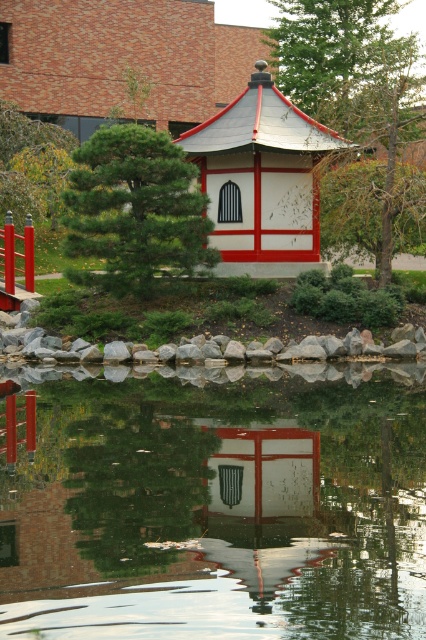
Who is positioned more to the left, green leafy tree at center or green leafy tree at upper left?

green leafy tree at upper left

This screenshot has width=426, height=640. In order to click on green leafy tree at center in this screenshot , I will do `click(353, 77)`.

Is green textured pine tree at center shorter than white matte gazebo at center?

In fact, green textured pine tree at center may be taller than white matte gazebo at center.

Does point (198, 234) come farther from viewer compared to point (284, 163)?

That is False.

The image size is (426, 640). Find the location of `green textured pine tree at center`. green textured pine tree at center is located at coordinates click(x=135, y=211).

Who is more distant from viewer, (x=127, y=634) or (x=89, y=198)?

Positioned behind is point (x=89, y=198).

The image size is (426, 640). Find the location of `transparent glass water at center`. transparent glass water at center is located at coordinates (216, 502).